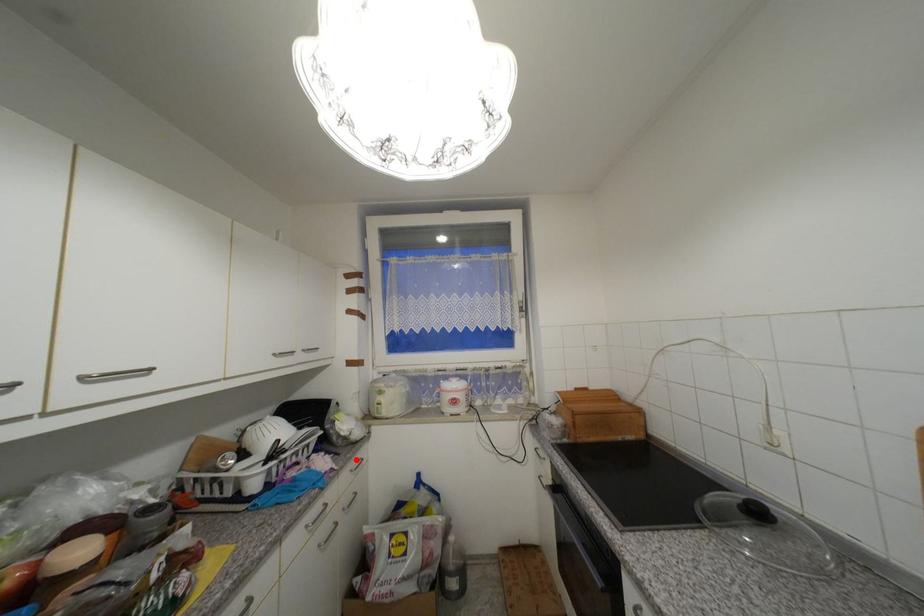
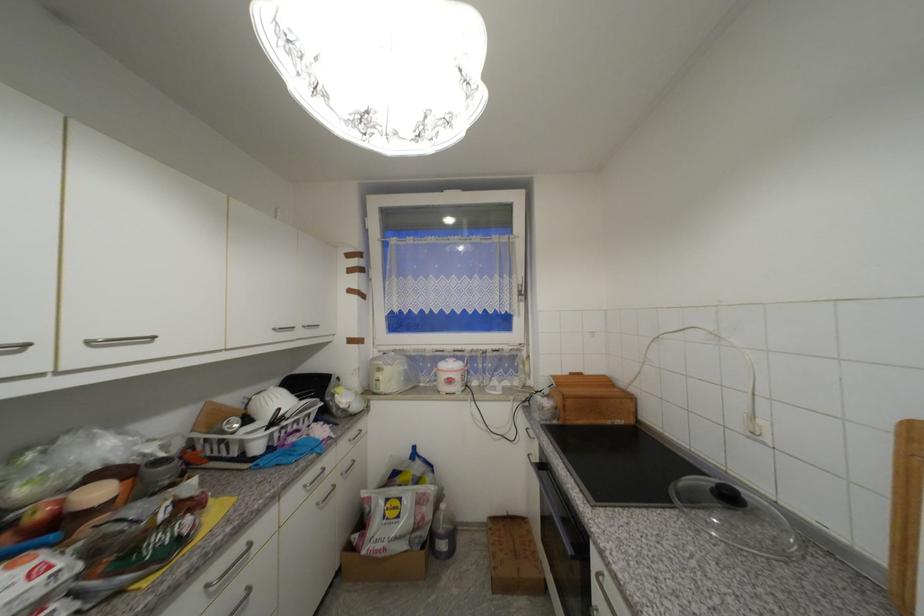
In the second image, find the point that corresponds to the highlighted location in the first image.

(354, 430)